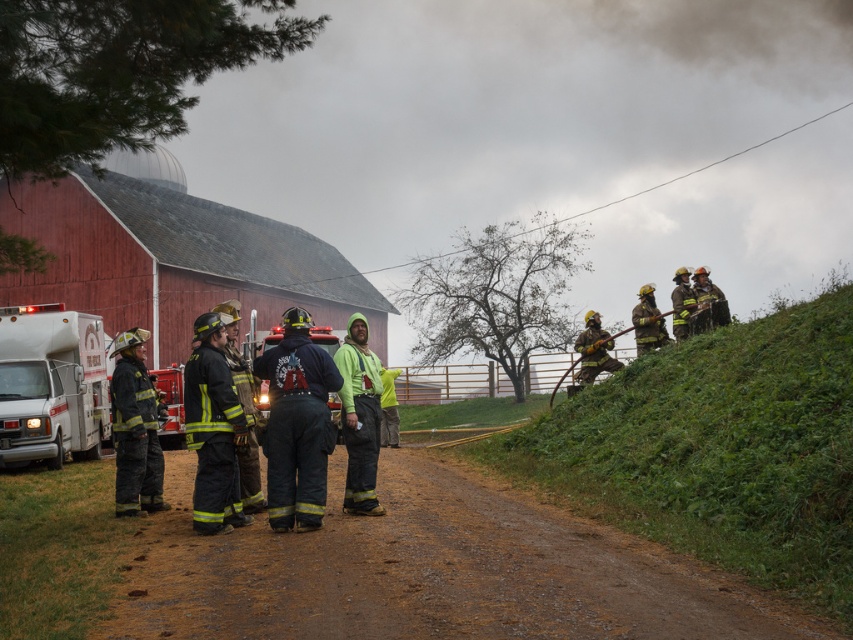
You are a firefighter arriving at the scene and need to locate your assigned equipment. Your equipment is stored on the shiny black fire truck at center. From your current position near the reflective silver helmet at upper right, in which direction should you move to reach the fire truck?

The shiny black fire truck at center is located below the reflective silver helmet at upper right, so you should move downward from the reflective silver helmet at upper right to reach the fire truck.

You are a firefighter arriving at the scene and need to locate your equipment. You see the shiny silver fire truck at center and the shiny silver helmet at right. Which object is bigger?

The shiny silver fire truck at center is larger in size compared to the shiny silver helmet at right.